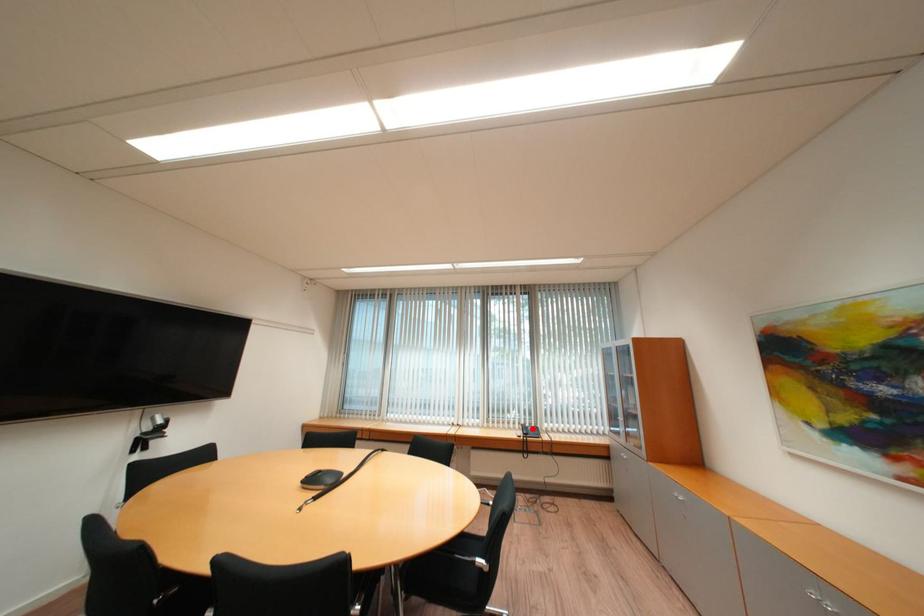
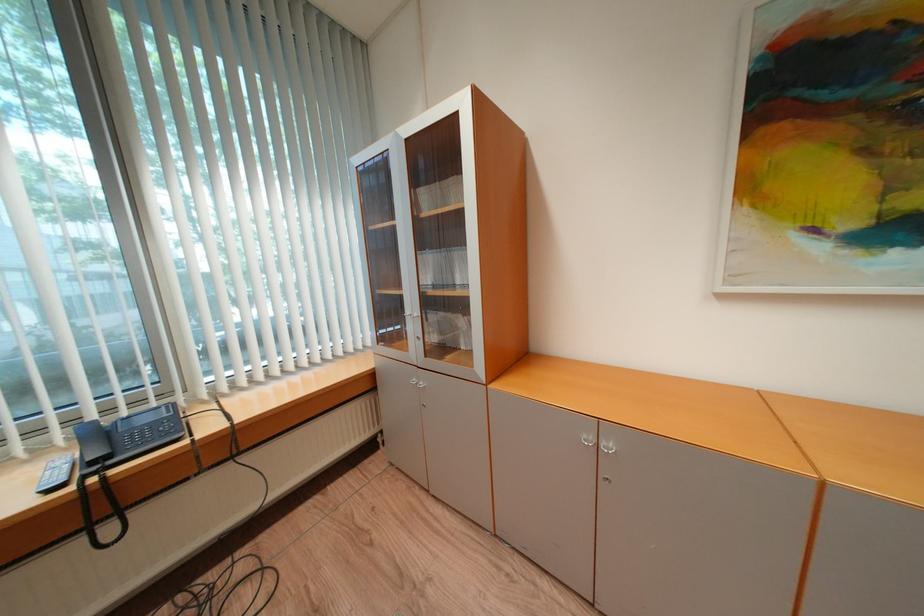
In the second image, find the point that corresponds to the highlighted location in the first image.

(104, 434)